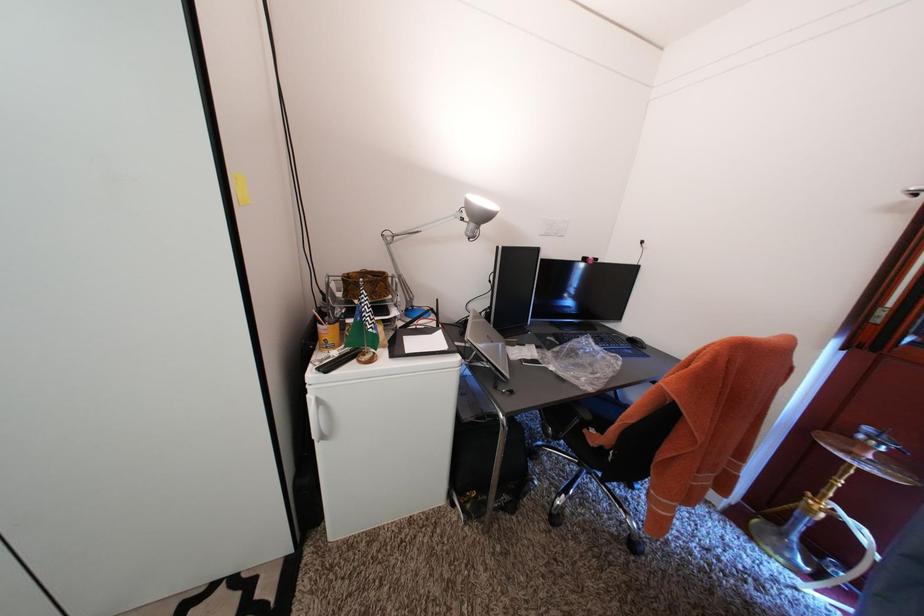
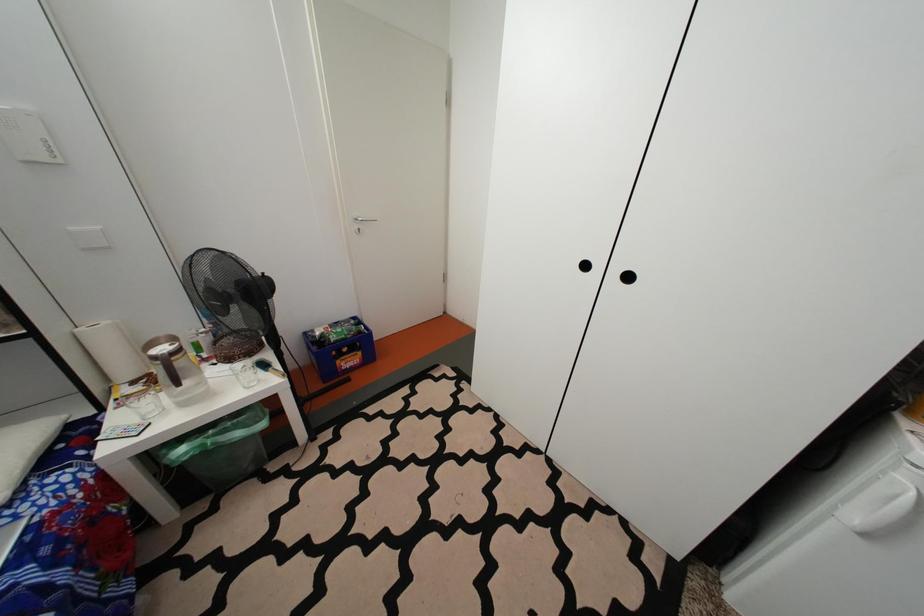
Question: The images are taken continuously from a first-person perspective. In which direction is your viewpoint rotating?

Choices:
 (A) Left
 (B) Right
 (C) Up
 (D) Down

Answer: (A)